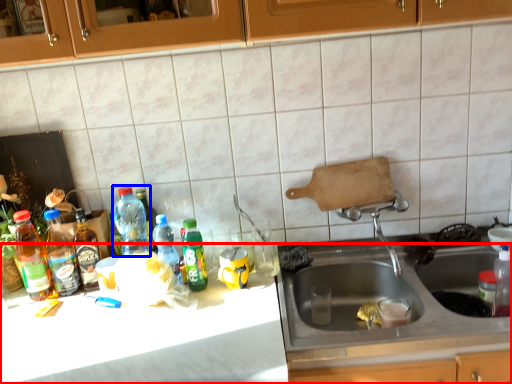
Question: Which object is further to the camera taking this photo, counter top (highlighted by a red box) or bottle (highlighted by a blue box)?

Choices:
 (A) counter top
 (B) bottle

Answer: (B)